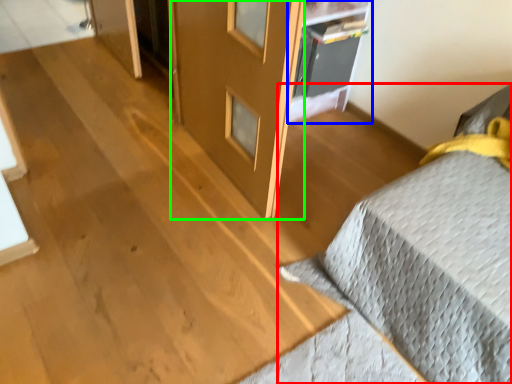
Question: Considering the real-world distances, which object is farthest from furniture (highlighted by a red box)? shelf (highlighted by a blue box) or screen door (highlighted by a green box)?

Choices:
 (A) shelf
 (B) screen door

Answer: (A)